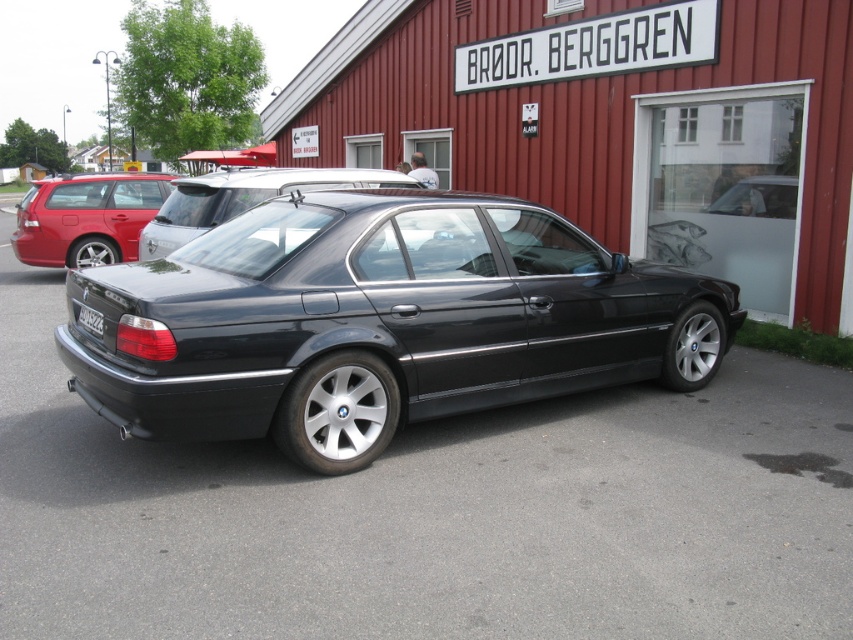
You are standing at the point with coordinates 0.5, 0.4 in the image. You want to move to the glossy black car at center. In which direction should you move?

Since the glossy black car at center is located at point (378, 321), you should move northeast to reach it from your current position at (340, 320).

What is the spatial relationship between the matte black station wagon at left and the satin black car at center in the scene?

The satin black car at center is positioned behind the matte black station wagon at left.

You are standing in front of the red building with white trim and want to take a photo of the matte black station wagon at left. Where should you position yourself to ensure the entire vehicle is in the frame?

Position yourself at point (86, 218) to capture the matte black station wagon at left in full view.